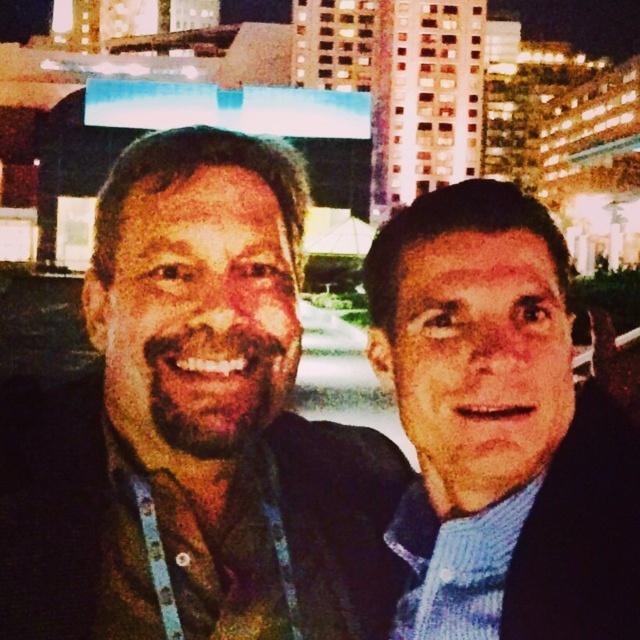
Looking at this image, does blue knit sweater at right have a smaller size compared to smooth skin face at center?

No, blue knit sweater at right is not smaller than smooth skin face at center.

Can you confirm if blue knit sweater at right is shorter than smooth skin face at center?

No.

Identify the location of blue knit sweater at right. (499, 428).

Where is `blue knit sweater at right`? The image size is (640, 640). blue knit sweater at right is located at coordinates (499, 428).

Looking at this image, can you confirm if blue knit sweater at right is thinner than brown matte face at left?

No, blue knit sweater at right is not thinner than brown matte face at left.

Can you confirm if blue knit sweater at right is wider than brown matte face at left?

Yes, blue knit sweater at right is wider than brown matte face at left.

Describe the element at coordinates (499, 428) in the screenshot. Image resolution: width=640 pixels, height=640 pixels. I see `blue knit sweater at right` at that location.

Where is `blue knit sweater at right`? This screenshot has width=640, height=640. blue knit sweater at right is located at coordinates (499, 428).

Which is more to the right, brown leather jacket at left or smooth skin face at center?

Positioned to the right is smooth skin face at center.

Does brown leather jacket at left appear under smooth skin face at center?

Incorrect, brown leather jacket at left is not positioned below smooth skin face at center.

Who is more distant from viewer, (24, 600) or (464, 468)?

The point (464, 468) is more distant.

The height and width of the screenshot is (640, 640). In order to click on brown leather jacket at left in this screenshot , I will do `click(193, 422)`.